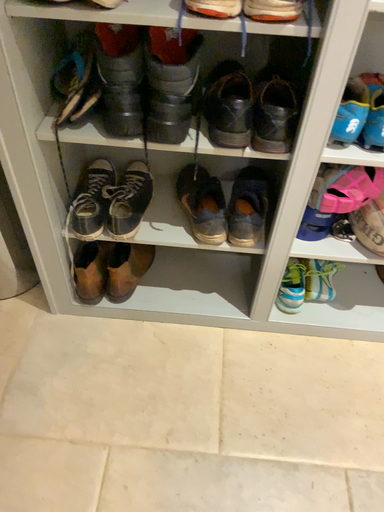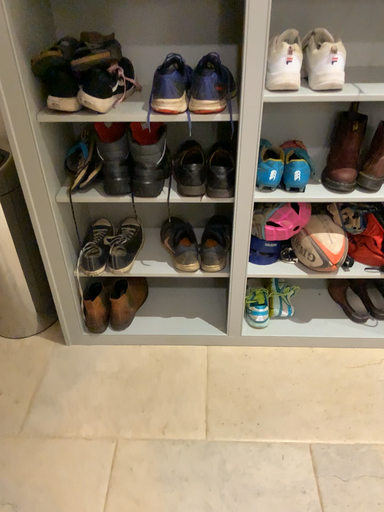
Question: Which way did the camera rotate in the video?

Choices:
 (A) rotated upward
 (B) rotated downward

Answer: (A)